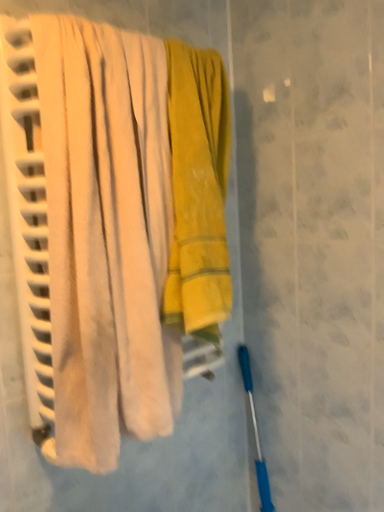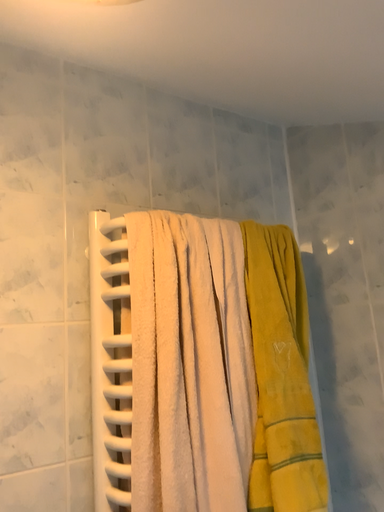
Question: How did the camera likely rotate when shooting the video?

Choices:
 (A) rotated right
 (B) rotated left

Answer: (B)